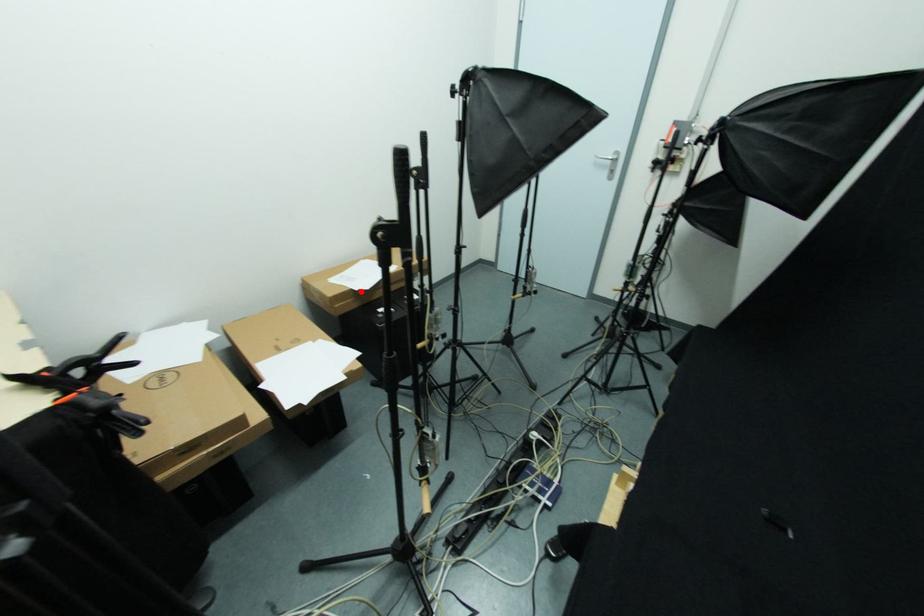
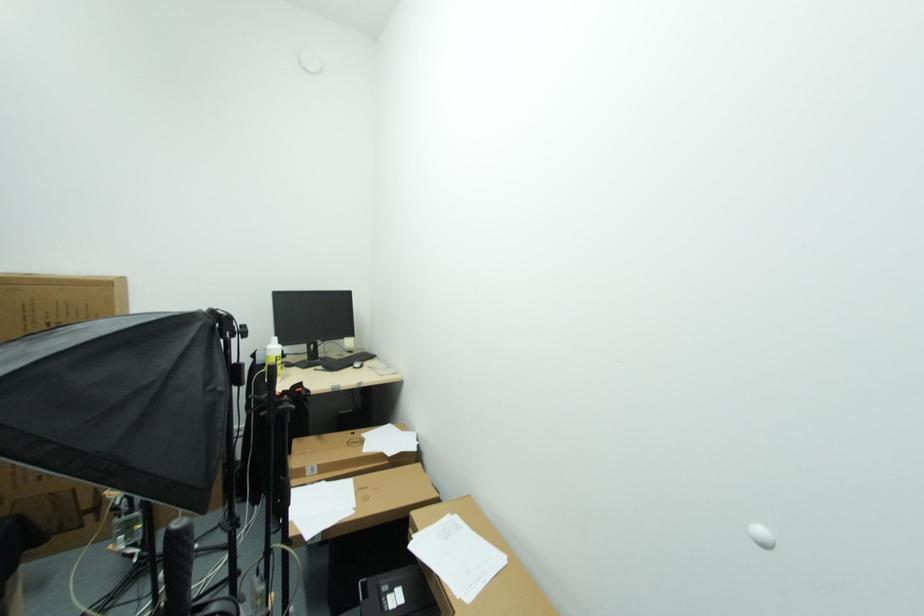
Question: I am providing you with two images of the same scene from different viewpoints. Image1 has a red point marked. In image2, the corresponding 3D location appears at what relative position? Reply with the corresponding letter.

Choices:
 (A) Closer
 (B) Farther

Answer: (B)